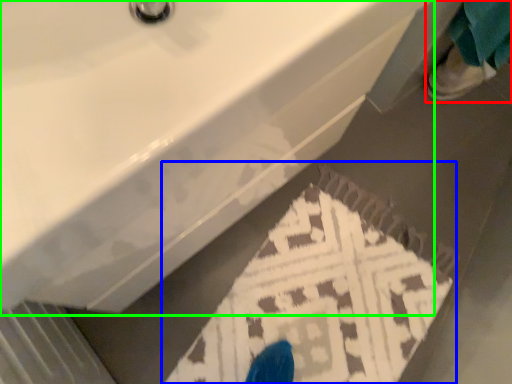
Question: Estimate the real-world distances between objects in this image. Which object is farther from person (highlighted by a red box), doormat (highlighted by a blue box) or sink (highlighted by a green box)?

Choices:
 (A) doormat
 (B) sink

Answer: (B)